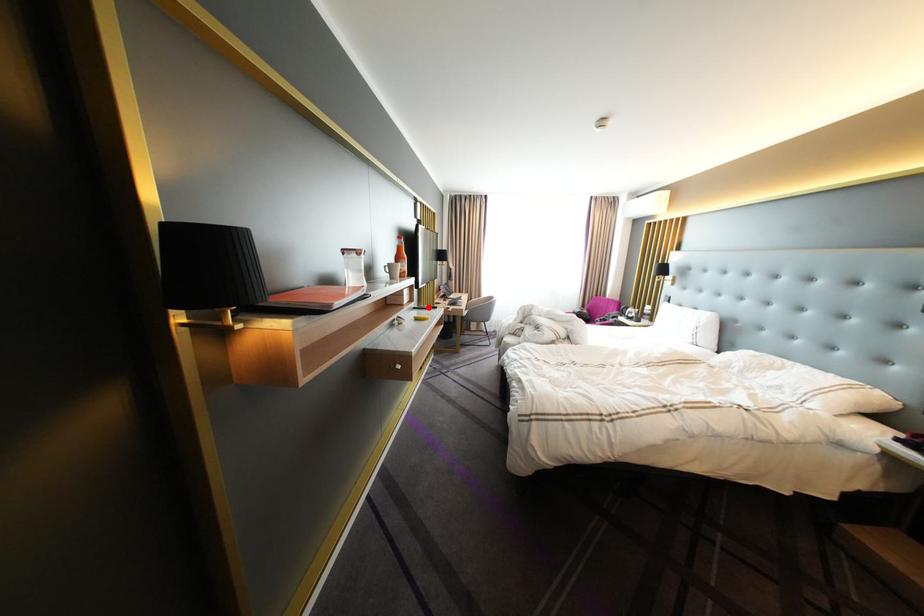
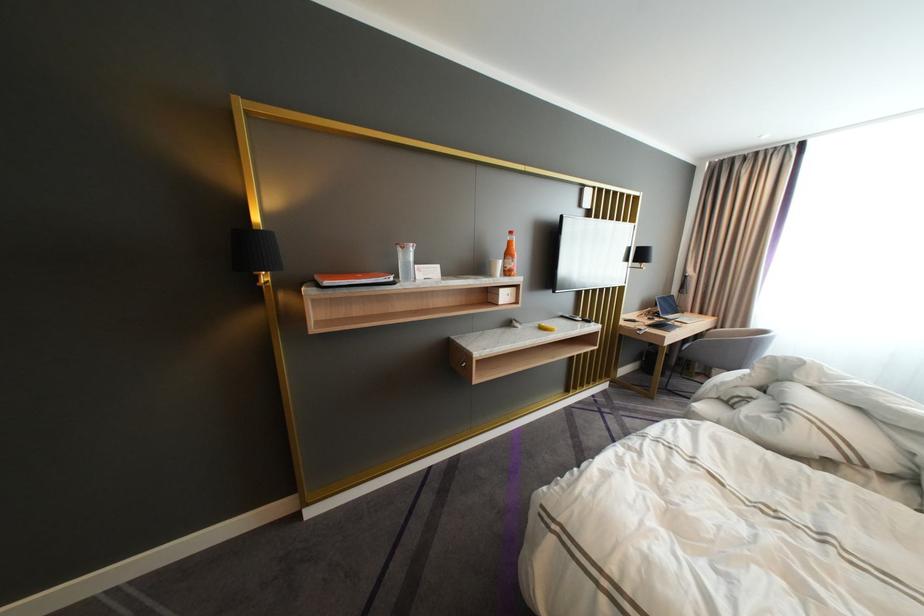
In the second image, find the point that corresponds to the highlighted location in the first image.

(578, 315)